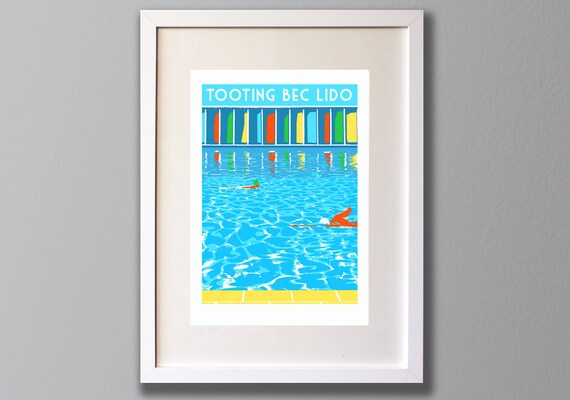
Identify the location of gray wall. (462, 206), (55, 207).